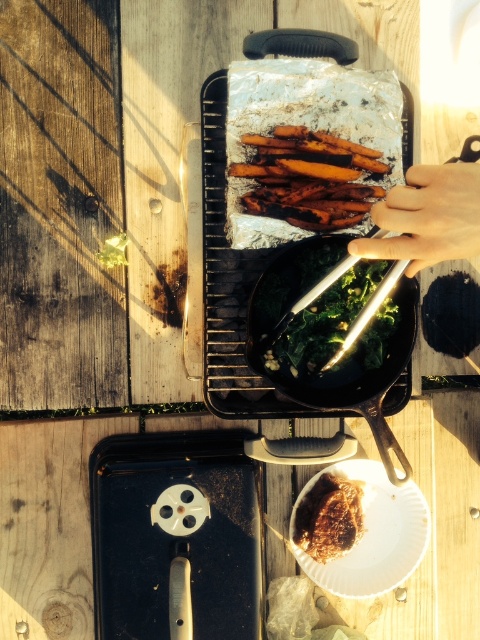
You are setting up a picnic and need to choose between the brown paper plate at lower center and the black cast iron skillet at center for carrying food. Which item takes up more space?

The black cast iron skillet at center takes up more space than the brown paper plate at lower center.